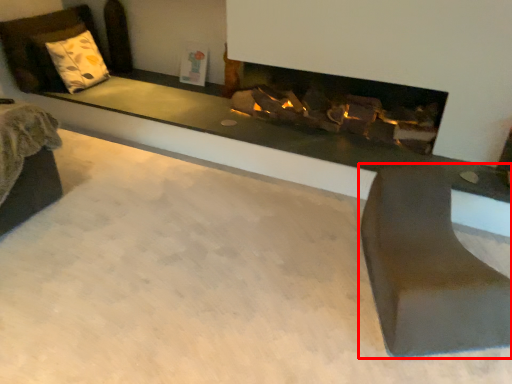
Question: Observing the image, what is the correct spatial positioning of furniture (annotated by the red box) in reference to pillow?

Choices:
 (A) left
 (B) right

Answer: (B)